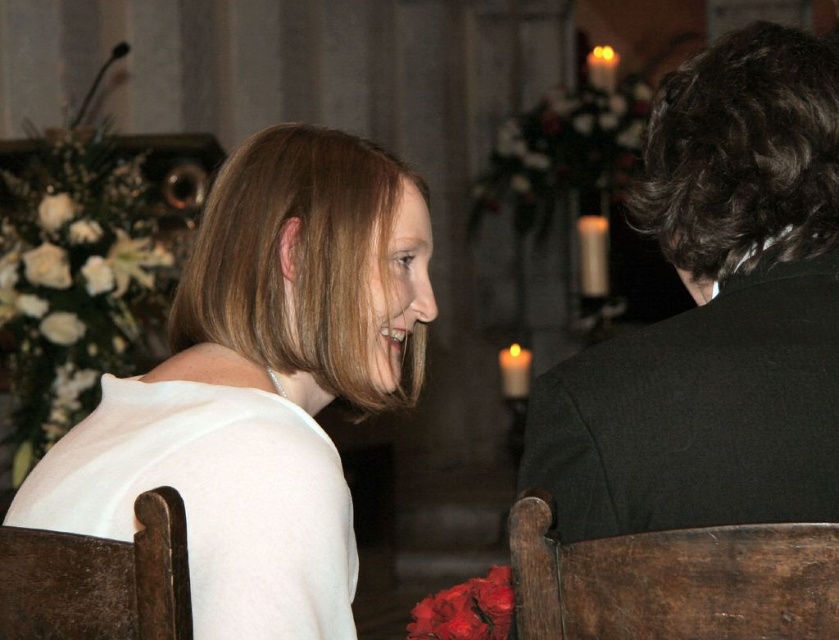
Which is behind, point (301, 282) or point (718, 124)?

The point (301, 282) is more distant.

Which is in front, point (242, 429) or point (723, 298)?

Point (723, 298) is in front.

Who is more distant from viewer, [180,346] or [586,486]?

The point [180,346] is behind.

You are a GUI agent. You are given a task and a screenshot of the screen. Output one action in this format:
    pyautogui.click(x=<x>, y=<y>)
    Task: Click on the white satin dress at upper left
    
    Given the screenshot: What is the action you would take?
    pyautogui.click(x=262, y=385)

Which is above, dark brown wooden chair at right or wooden chair at lower left?

dark brown wooden chair at right

Who is positioned more to the left, dark brown wooden chair at right or wooden chair at lower left?

Positioned to the left is wooden chair at lower left.

Is point (513, 531) closer to viewer compared to point (116, 573)?

Yes, point (513, 531) is closer to viewer.

Where is `dark brown wooden chair at right`? Image resolution: width=839 pixels, height=640 pixels. dark brown wooden chair at right is located at coordinates (673, 580).

Based on the photo, is white satin dress at upper left to the right of wooden chair at lower left from the viewer's perspective?

Indeed, white satin dress at upper left is positioned on the right side of wooden chair at lower left.

Can you confirm if white satin dress at upper left is positioned to the left of wooden chair at lower left?

No, white satin dress at upper left is not to the left of wooden chair at lower left.

Is point (266, 339) less distant than point (159, 541)?

No, (266, 339) is further to viewer.

You are a GUI agent. You are given a task and a screenshot of the screen. Output one action in this format:
    pyautogui.click(x=<x>, y=<y>)
    Task: Click on the white satin dress at upper left
    
    Given the screenshot: What is the action you would take?
    pyautogui.click(x=262, y=385)